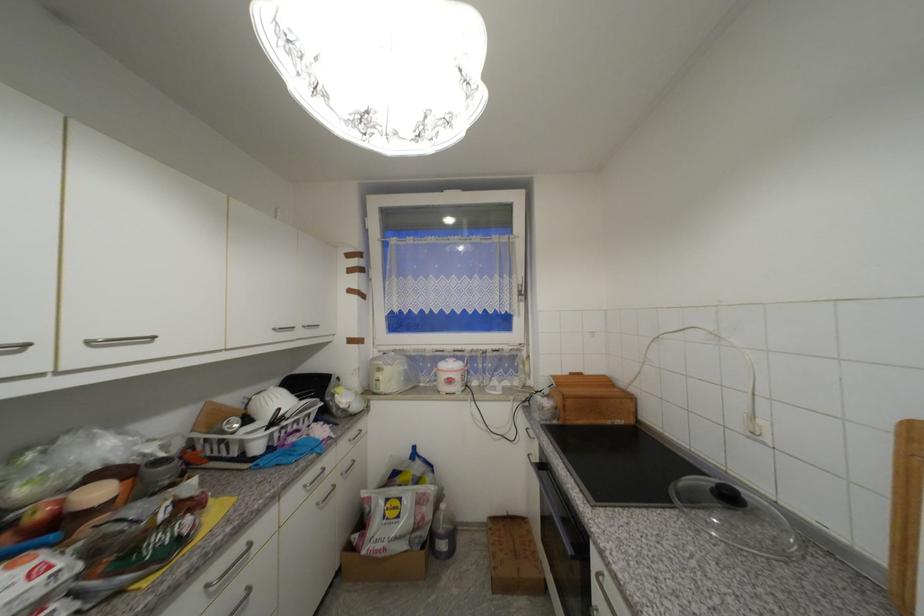
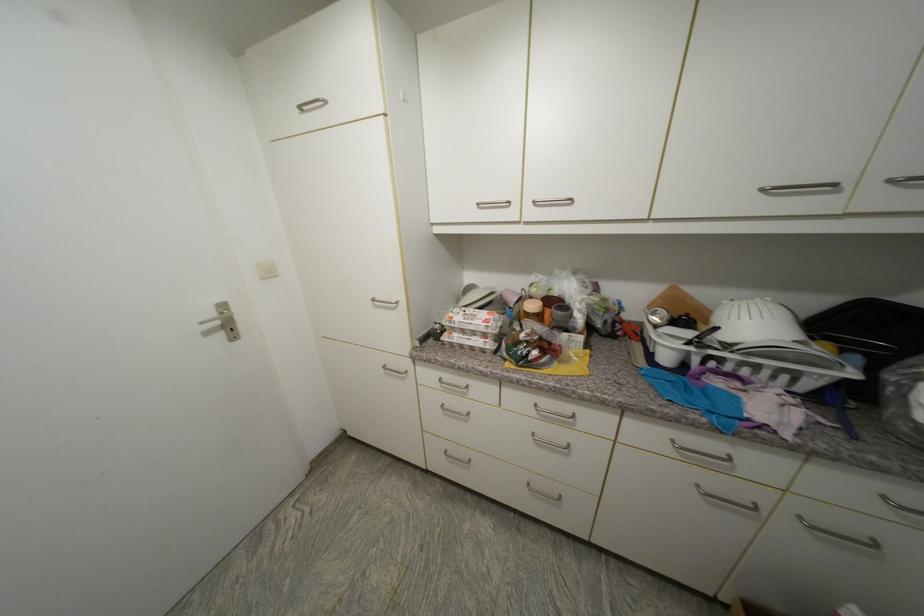
The first image is from the beginning of the video and the second image is from the end. How did the camera likely rotate when shooting the video?

The camera's rotation is toward left-down.